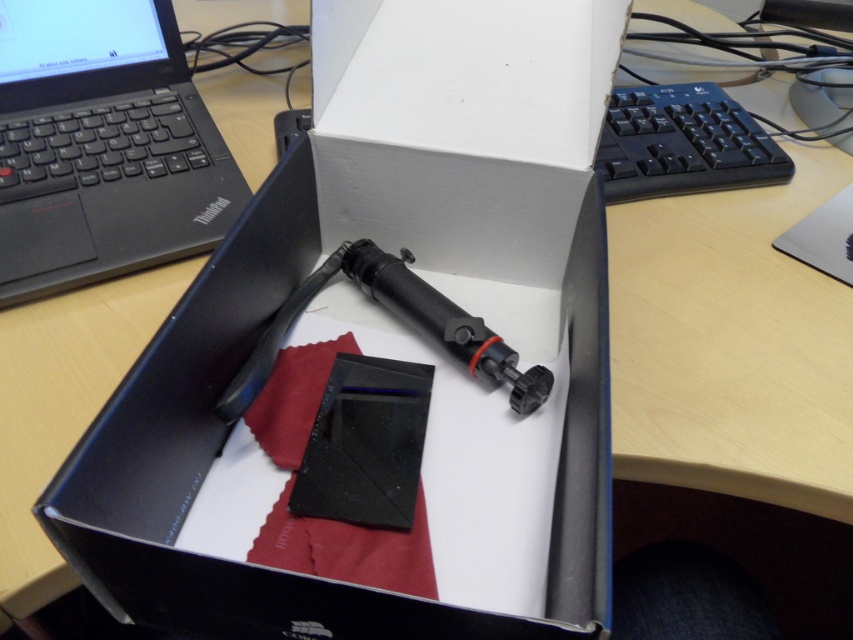
Question: Can you confirm if black matte thinkpad at upper left is thinner than black rubberized pen at center?

Choices:
 (A) no
 (B) yes

Answer: (A)

Question: Is black matte thinkpad at upper left to the left of black rubberized pen at center from the viewer's perspective?

Choices:
 (A) no
 (B) yes

Answer: (B)

Question: Estimate the real-world distances between objects in this image. Which object is farther from the black plastic keyboard at upper right?

Choices:
 (A) black matte thinkpad at upper left
 (B) black rubberized pen at center

Answer: (A)

Question: Which object is the closest to the black matte thinkpad at upper left?

Choices:
 (A) black plastic keyboard at upper right
 (B) black rubberized pen at center

Answer: (B)

Question: Does black matte thinkpad at upper left have a greater width compared to black plastic keyboard at upper right?

Choices:
 (A) no
 (B) yes

Answer: (B)

Question: Estimate the real-world distances between objects in this image. Which object is farther from the black matte thinkpad at upper left?

Choices:
 (A) black rubberized pen at center
 (B) black plastic keyboard at upper right

Answer: (B)